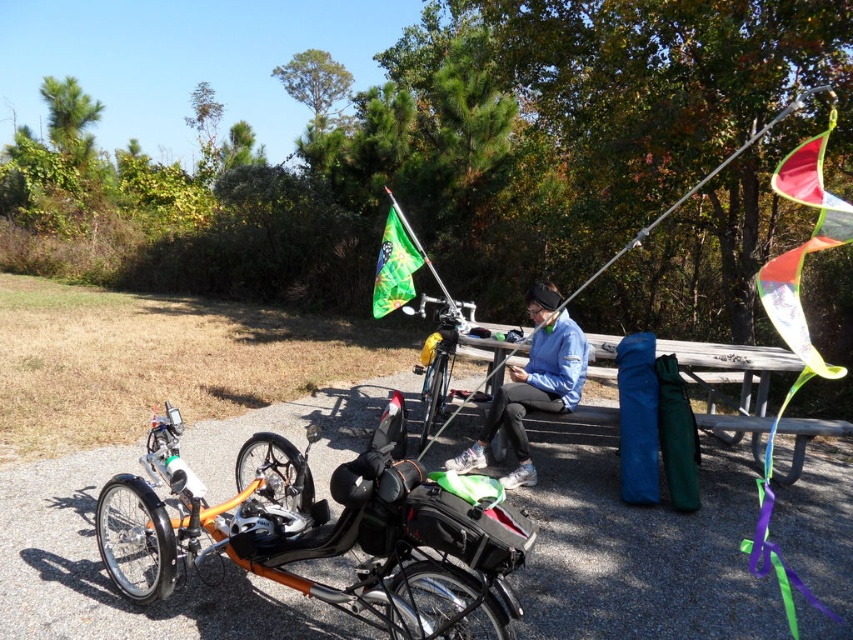
Question: Can you confirm if orange matte trike at lower left is positioned below blue fabric jacket at center?

Choices:
 (A) yes
 (B) no

Answer: (A)

Question: Which object appears closest to the camera in this image?

Choices:
 (A) green fabric flag at center
 (B) yellow matte bicycle at center
 (C) orange matte trike at lower left
 (D) blue fabric jacket at center

Answer: (C)

Question: In this image, where is orange matte trike at lower left located relative to yellow matte bicycle at center?

Choices:
 (A) left
 (B) right

Answer: (A)

Question: Can you confirm if orange matte trike at lower left is positioned to the left of blue fabric jacket at center?

Choices:
 (A) no
 (B) yes

Answer: (B)

Question: Estimate the real-world distances between objects in this image. Which object is closer to the blue fabric jacket at center?

Choices:
 (A) yellow matte bicycle at center
 (B) green fabric flag at center

Answer: (A)

Question: Which object is positioned closest to the orange matte trike at lower left?

Choices:
 (A) blue fabric jacket at center
 (B) green fabric flag at center

Answer: (A)